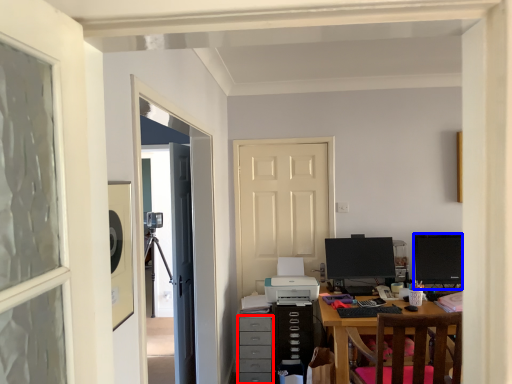
Question: Which object appears farthest to the camera in this image, drawer (highlighted by a red box) or computer monitor (highlighted by a blue box)?

Choices:
 (A) drawer
 (B) computer monitor

Answer: (B)